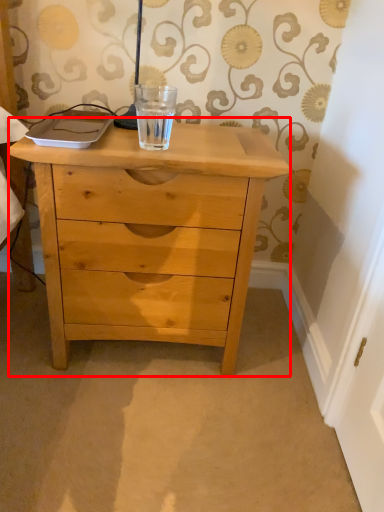
Question: From the image's perspective, where is chest of drawers (annotated by the red box) located in relation to beverage in the image?

Choices:
 (A) below
 (B) above

Answer: (A)